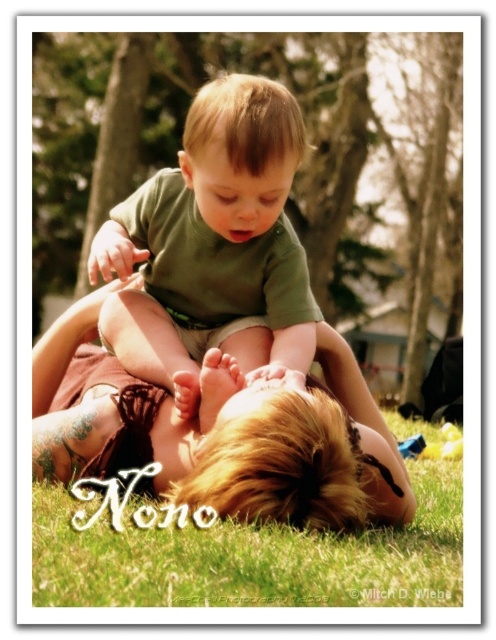
Does brown leather boots at lower center appear on the right side of green grass at lower center?

Incorrect, brown leather boots at lower center is not on the right side of green grass at lower center.

Can you confirm if brown leather boots at lower center is smaller than green grass at lower center?

No.

Identify the location of brown leather boots at lower center. Image resolution: width=496 pixels, height=640 pixels. (219, 433).

Can you confirm if brown leather boots at lower center is thinner than green matte shirt at center?

Incorrect, brown leather boots at lower center's width is not less than green matte shirt at center's.

Is brown leather boots at lower center taller than green matte shirt at center?

No.

Is point (34, 372) positioned behind point (189, 371)?

Yes, point (34, 372) is behind point (189, 371).

At what (x,y) coordinates should I click in order to perform the action: click on brown leather boots at lower center. Please return your answer as a coordinate pair (x, y). Image resolution: width=496 pixels, height=640 pixels. Looking at the image, I should click on [x=219, y=433].

Is point (289, 317) positioned before point (388, 595)?

No, it is behind (388, 595).

Which is below, green matte shirt at center or green grass at lower center?

green grass at lower center is lower down.

Where is `green matte shirt at center`? green matte shirt at center is located at coordinates pyautogui.click(x=213, y=246).